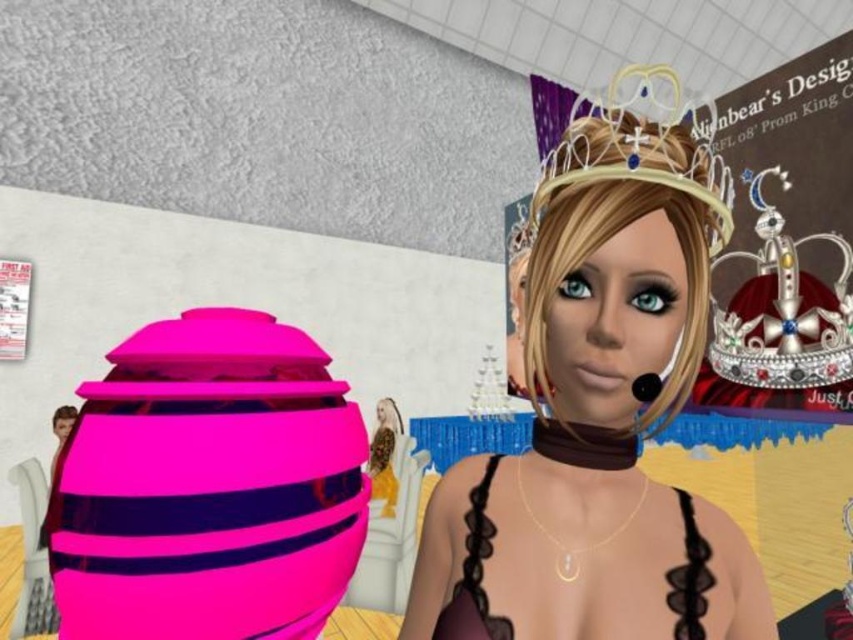
Question: Based on their relative distances, which object is farther from the matte purple dress at center?

Choices:
 (A) shiny plastic crown at upper center
 (B) silver metallic crown at upper center

Answer: (B)

Question: Does silver metallic crown at upper center have a larger size compared to shiny silver crown at upper center?

Choices:
 (A) no
 (B) yes

Answer: (A)

Question: Which of the following is the farthest from the observer?

Choices:
 (A) (531, 212)
 (B) (755, 211)
 (C) (445, 618)
 (D) (548, 198)

Answer: (B)

Question: Is silver metallic crown at upper center behind matte purple dress at center?

Choices:
 (A) no
 (B) yes

Answer: (B)

Question: Is shiny silver crown at upper center bigger than matte purple dress at center?

Choices:
 (A) yes
 (B) no

Answer: (A)

Question: Which object is positioned closest to the shiny plastic crown at upper center?

Choices:
 (A) silver metallic crown at upper center
 (B) matte purple dress at center
 (C) shiny silver crown at upper center

Answer: (C)